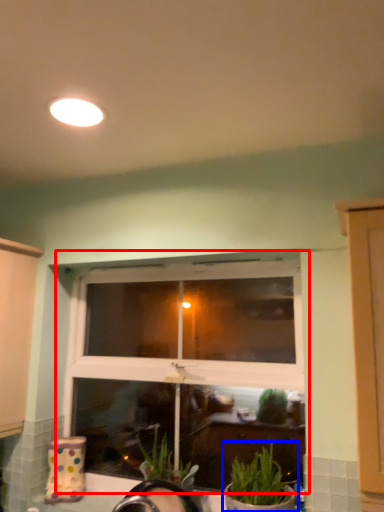
Question: Which object appears farthest to the camera in this image, window (highlighted by a red box) or houseplant (highlighted by a blue box)?

Choices:
 (A) window
 (B) houseplant

Answer: (A)